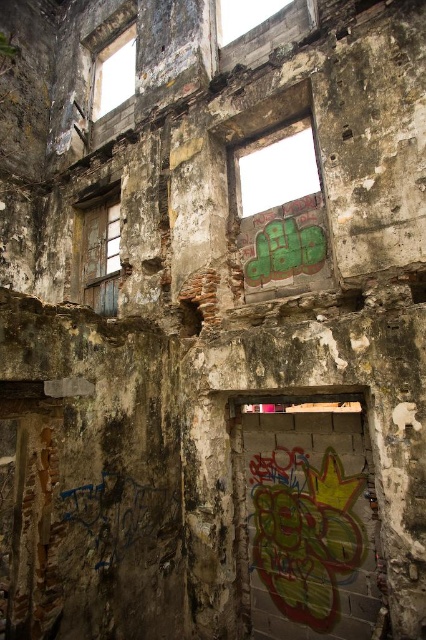
Does wooden window at left have a smaller size compared to transparent glass window at upper left?

Yes.

I want to click on wooden window at left, so click(x=100, y=250).

The image size is (426, 640). Find the location of `wooden window at left`. wooden window at left is located at coordinates (100, 250).

Locate an element on the screen. wooden window at left is located at coordinates (100, 250).